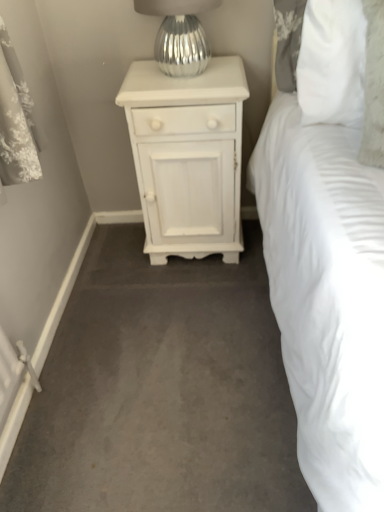
Where is `vacant space underneath silver metallic vase at upper center (from a real-world perspective)`? The image size is (384, 512). vacant space underneath silver metallic vase at upper center (from a real-world perspective) is located at coordinates [x=183, y=76].